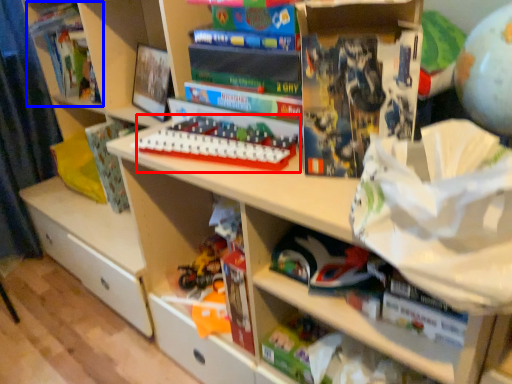
Question: Which object appears farthest to the camera in this image, toy (highlighted by a red box) or book (highlighted by a blue box)?

Choices:
 (A) toy
 (B) book

Answer: (B)